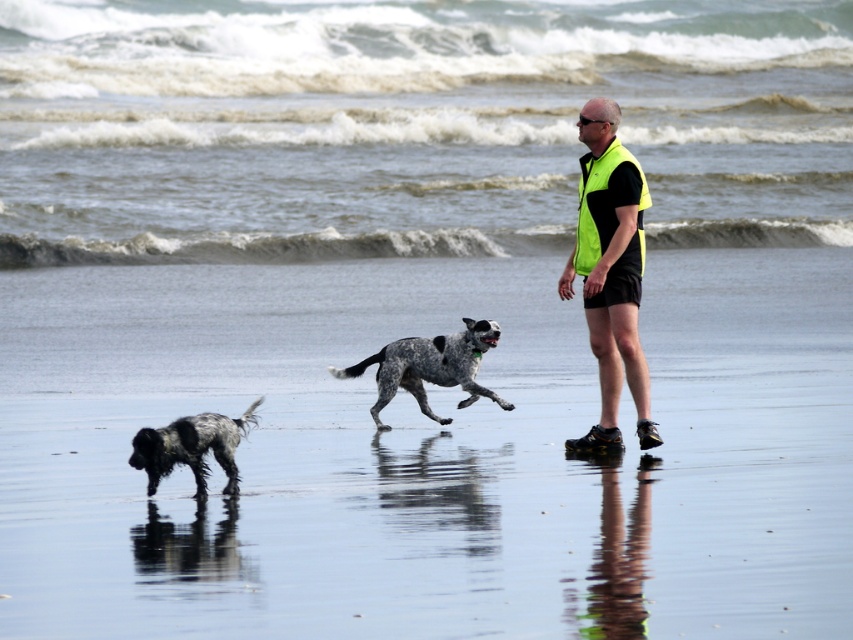
Looking at this image, you are a photographer trying to capture the man and the dog in the scene. Since the neon yellow vest at center and the spotted fur dog at lower left are both important subjects, which one should you focus on first to ensure they are both in sharp focus?

The neon yellow vest at center is above the spotted fur dog at lower left, so focusing on the neon yellow vest at center first will help ensure both subjects are in sharp focus as the dog is lower in the frame.

You are a photographer trying to capture a wide shot of the beach scene. You want to ensure that both the shiny wet sand at center and the neon yellow vest at center are clearly visible in your photo. Given their sizes, which object will occupy more space in the final image?

The shiny wet sand at center will occupy more space in the final image because its width is larger than that of the neon yellow vest at center.

You are a photographer standing at the edge of the beach. You want to take a photo that includes both the neon yellow vest at center and the spotted fur dog at lower left. The camera has a maximum focus range of 2.5 meters. Can you capture both subjects in focus without moving either the man or the dog?

The neon yellow vest at center is 2.73 meters from the spotted fur dog at lower left. Since the distance between them exceeds the camera maximum focus range of 2.5 meters, you cannot capture both subjects in focus without moving either the man or the dog.